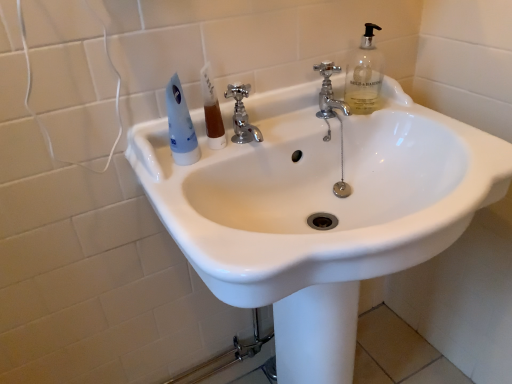
Question: Which direction should I rotate to face polished chrome faucet at upper center, positioned as the 1th tap in right-to-left order, — up or down?

Choices:
 (A) down
 (B) up

Answer: (B)

Question: Can you confirm if brown translucent liquid at center is bigger than polished chrome faucet at upper center, positioned as the 1th tap in right-to-left order?

Choices:
 (A) yes
 (B) no

Answer: (B)

Question: Is brown translucent liquid at center to the right of polished chrome faucet at upper center, positioned as the 1th tap in right-to-left order, from the viewer's perspective?

Choices:
 (A) no
 (B) yes

Answer: (A)

Question: Would you say brown translucent liquid at center is outside polished chrome faucet at upper center, positioned as the 2th tap in left-to-right order?

Choices:
 (A) no
 (B) yes

Answer: (B)

Question: Can you confirm if brown translucent liquid at center is thinner than polished chrome faucet at upper center, positioned as the 1th tap in right-to-left order?

Choices:
 (A) yes
 (B) no

Answer: (A)

Question: Does brown translucent liquid at center lie behind polished chrome faucet at upper center, positioned as the 2th tap in left-to-right order?

Choices:
 (A) no
 (B) yes

Answer: (A)

Question: Does brown translucent liquid at center have a lesser height compared to polished chrome faucet at upper center, positioned as the 1th tap in right-to-left order?

Choices:
 (A) no
 (B) yes

Answer: (B)

Question: Is brown translucent liquid at center closer to the viewer compared to chrome metallic faucet at center, which is counted as the 1th tap, starting from the left?

Choices:
 (A) no
 (B) yes

Answer: (A)

Question: Is brown translucent liquid at center taller than chrome metallic faucet at center, which is counted as the 1th tap, starting from the left?

Choices:
 (A) no
 (B) yes

Answer: (A)

Question: Would you consider brown translucent liquid at center to be distant from chrome metallic faucet at center, which is counted as the 1th tap, starting from the left?

Choices:
 (A) yes
 (B) no

Answer: (B)

Question: Could you tell me if brown translucent liquid at center is facing chrome metallic faucet at center, which is counted as the 1th tap, starting from the left?

Choices:
 (A) no
 (B) yes

Answer: (A)

Question: From the image's perspective, is brown translucent liquid at center under chrome metallic faucet at center, which is counted as the 1th tap, starting from the left?

Choices:
 (A) no
 (B) yes

Answer: (B)

Question: Considering the relative sizes of brown translucent liquid at center and chrome metallic faucet at center, which is counted as the 1th tap, starting from the left, in the image provided, is brown translucent liquid at center smaller than chrome metallic faucet at center, which is counted as the 1th tap, starting from the left,?

Choices:
 (A) yes
 (B) no

Answer: (A)

Question: From a real-world perspective, is chrome metallic faucet at center, positioned as the second tap in right-to-left order, positioned under polished chrome faucet at upper center, positioned as the 1th tap in right-to-left order, based on gravity?

Choices:
 (A) no
 (B) yes

Answer: (A)